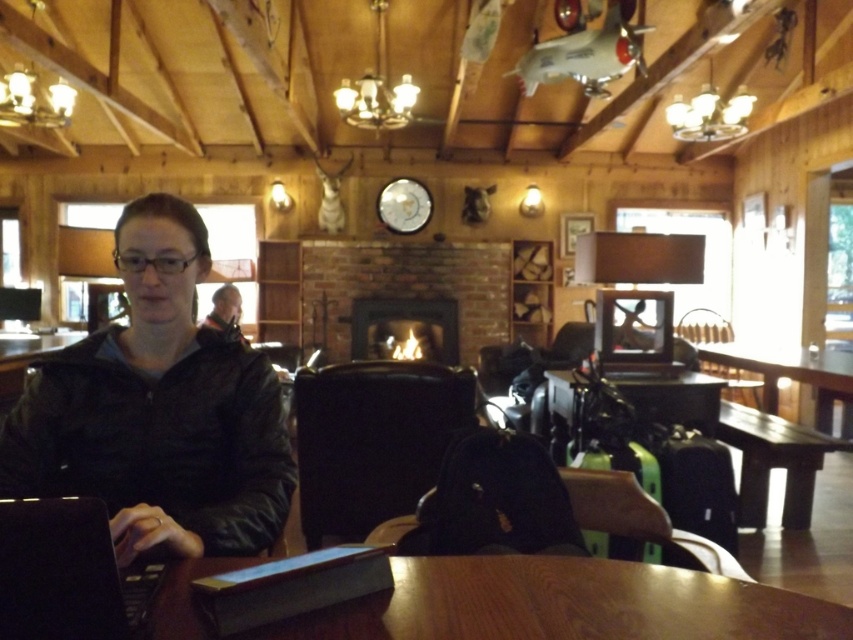
You are standing in the cabin and want to locate the point at coordinates (65,573). According to the scene description, where exactly is this point located?

The point at coordinates (65,573) is on the black matte laptop at lower left.